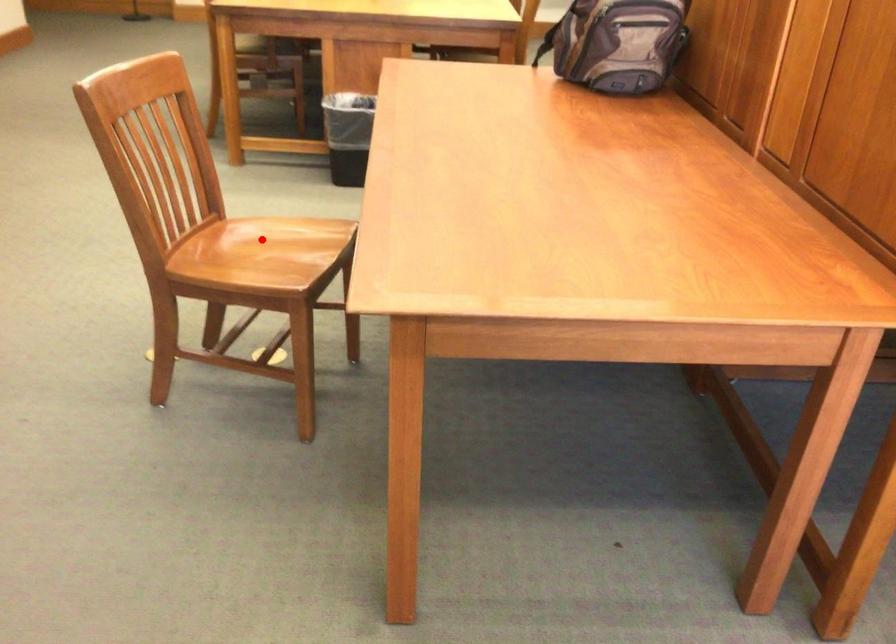
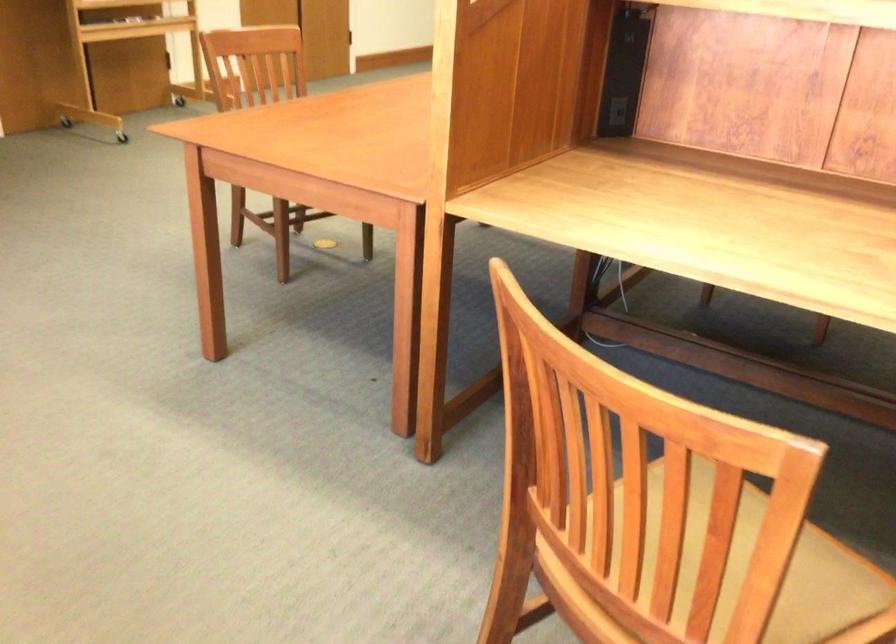
Question: I am providing you with two images of the same scene from different viewpoints. A red point is marked on the first image. Is the red point's position out of view in image 2?

Choices:
 (A) Yes
 (B) No

Answer: (A)